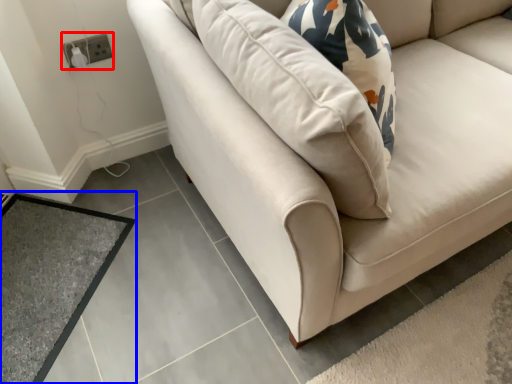
Question: Which object is closer to the camera taking this photo, electric outlet (highlighted by a red box) or mat (highlighted by a blue box)?

Choices:
 (A) electric outlet
 (B) mat

Answer: (B)